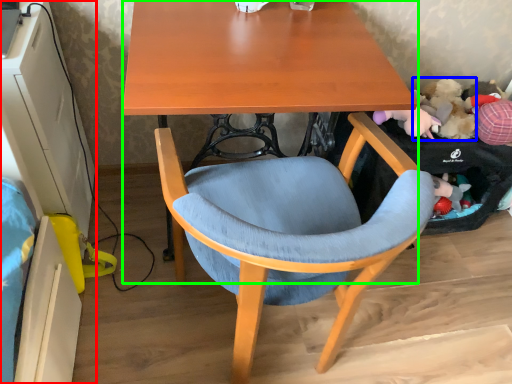
Question: Which object is positioned farthest from computer desk (highlighted by a red box)? Select from toy (highlighted by a blue box) and desk (highlighted by a green box).

Choices:
 (A) toy
 (B) desk

Answer: (A)